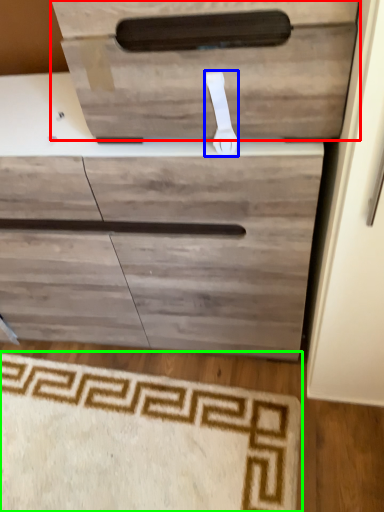
Question: Which object is the farthest from drawer (highlighted by a red box)? Choose among these: door handle (highlighted by a blue box) or doormat (highlighted by a green box).

Choices:
 (A) door handle
 (B) doormat

Answer: (B)